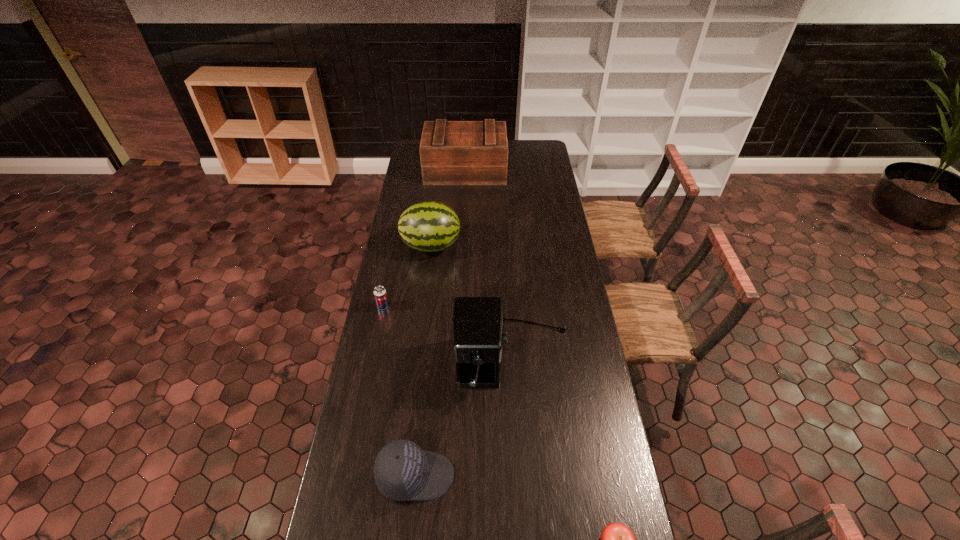
This screenshot has width=960, height=540. I want to click on vacant space at the right edge, so click(x=559, y=420).

The height and width of the screenshot is (540, 960). What are the coordinates of `vacant area between the second farthest object and the baseball cap` in the screenshot? It's located at (423, 361).

Locate an element on the screen. The image size is (960, 540). vacant point located between the third shortest object and the beer can is located at coordinates (399, 391).

Where is `object identified as the fourth closest to the apple`? object identified as the fourth closest to the apple is located at coordinates (429, 226).

Find the location of a particular element. the second closest object relative to the fifth farthest object is located at coordinates (617, 539).

I want to click on vacant point that satisfies the following two spatial constraints: 1. on the front-facing side of the coffee maker; 2. at the front of the second nearest object where the brim is located, so click(x=520, y=476).

You are a GUI agent. You are given a task and a screenshot of the screen. Output one action in this format:
    pyautogui.click(x=<x>, y=<y>)
    Task: Click on the free space that satisfies the following two spatial constraints: 1. on the front-facing side of the fourth farthest object; 2. at the front of the baseball cap where the brim is located
    Image resolution: width=960 pixels, height=540 pixels.
    Given the screenshot: What is the action you would take?
    pyautogui.click(x=520, y=476)